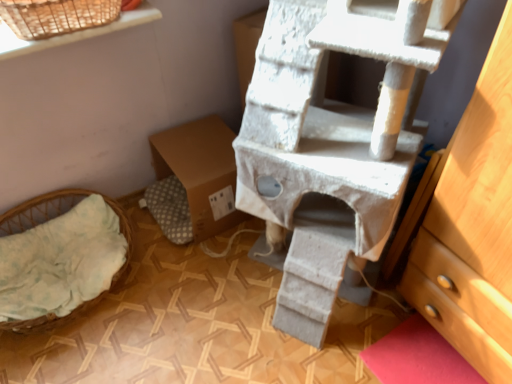
Question: Considering the positions of light green fabric basket at lower left and white textured cat tree at center in the image, is light green fabric basket at lower left taller or shorter than white textured cat tree at center?

Choices:
 (A) short
 (B) tall

Answer: (A)

Question: Considering the positions of light green fabric basket at lower left and white textured cat tree at center in the image, is light green fabric basket at lower left wider or thinner than white textured cat tree at center?

Choices:
 (A) thin
 (B) wide

Answer: (A)

Question: Which is farther from the brown cardboard box at center?

Choices:
 (A) light green fabric basket at lower left
 (B) white textured cat tree at center

Answer: (B)

Question: Which object is positioned farthest from the white textured cat tree at center?

Choices:
 (A) light green fabric basket at lower left
 (B) brown cardboard box at center

Answer: (A)